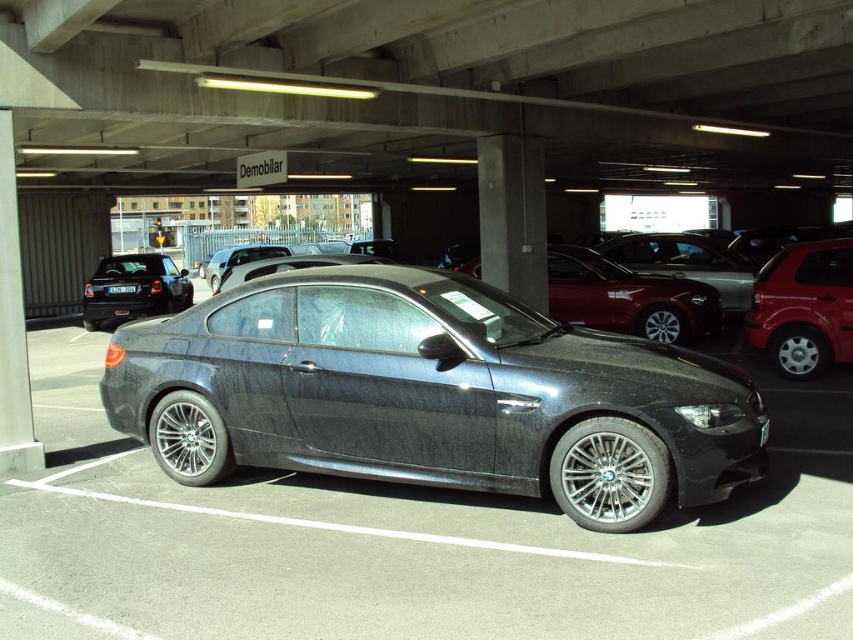
Is metallic gray car at center positioned at the back of metallic red sedan at center?

No, it is not.

Which is below, metallic gray car at center or metallic red sedan at center?

metallic gray car at center is below.

Who is more distant from viewer, [583,355] or [473,268]?

The point [473,268] is more distant.

At what (x,y) coordinates should I click in order to perform the action: click on metallic gray car at center. Please return your answer as a coordinate pair (x, y). Looking at the image, I should click on (432, 394).

Between metallic gray car at center and black plastic license plate at center, which one is positioned higher?

black plastic license plate at center

In the scene shown: Which is below, metallic gray car at center or black plastic license plate at center?

Positioned lower is metallic gray car at center.

Which is in front, point (524, 486) or point (132, 285)?

Point (524, 486)

Where is `metallic gray car at center`? Image resolution: width=853 pixels, height=640 pixels. metallic gray car at center is located at coordinates (432, 394).

Who is positioned more to the right, metallic gray car at center or metallic red hatchback at right?

From the viewer's perspective, metallic red hatchback at right appears more on the right side.

I want to click on metallic gray car at center, so click(x=432, y=394).

The image size is (853, 640). What are the coordinates of `metallic gray car at center` in the screenshot? It's located at (432, 394).